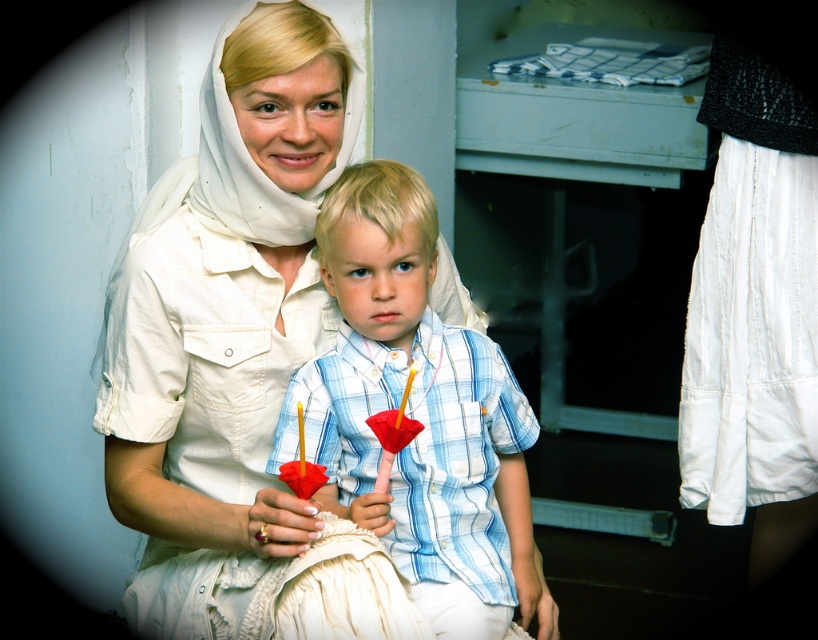
Question: Among these points, which one is nearest to the camera?

Choices:
 (A) (209, 83)
 (B) (767, 358)

Answer: (A)

Question: Considering the real-world distances, which object is closest to the white pleated skirt at lower right?

Choices:
 (A) light blue plaid shirt at center
 (B) white matte dress at center

Answer: (A)

Question: Is white matte dress at center smaller than white pleated skirt at lower right?

Choices:
 (A) no
 (B) yes

Answer: (A)

Question: Does white matte dress at center appear on the right side of white pleated skirt at lower right?

Choices:
 (A) yes
 (B) no

Answer: (B)

Question: Is white matte dress at center behind light blue plaid shirt at center?

Choices:
 (A) yes
 (B) no

Answer: (B)

Question: Which point is farther to the camera?

Choices:
 (A) (767, 10)
 (B) (317, 266)
 (C) (461, 339)

Answer: (A)